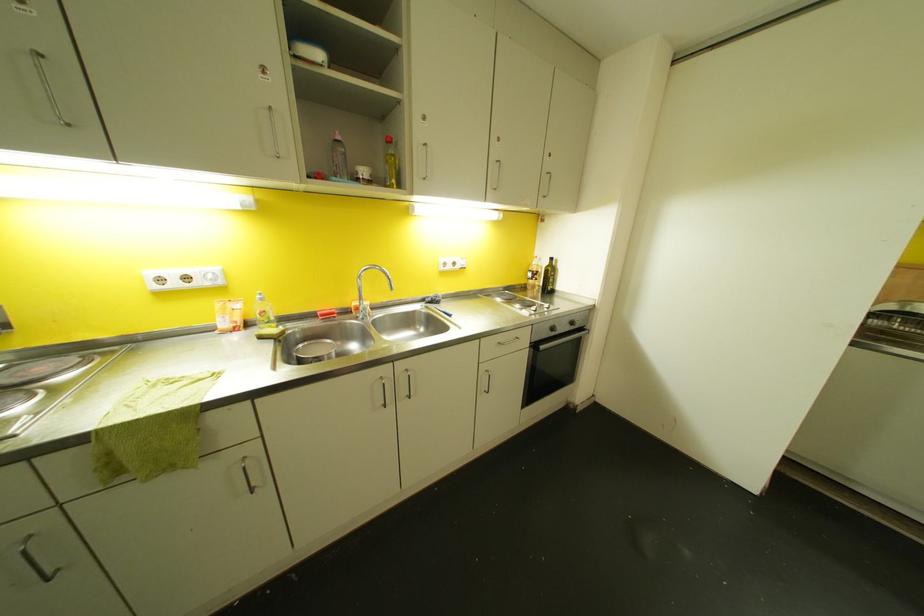
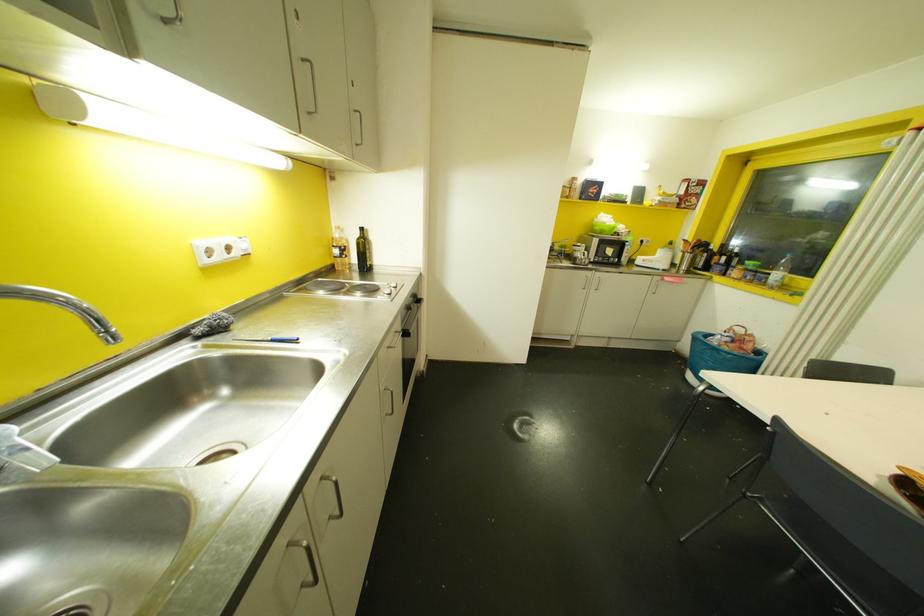
Find the pixel in the second image that matches (551,259) in the first image.

(360, 229)